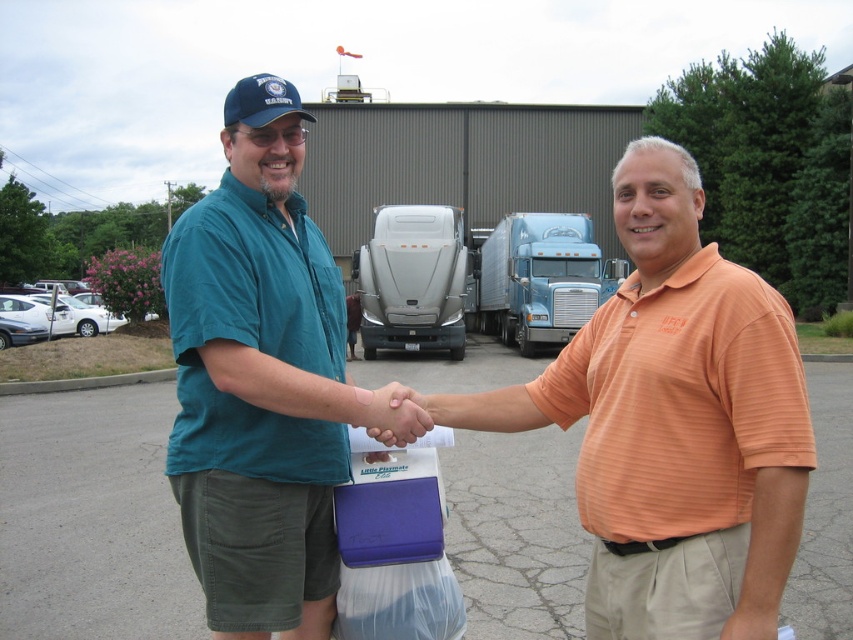
Who is positioned more to the left, blue metallic truck at center or satin silver semi-truck at center?

From the viewer's perspective, satin silver semi-truck at center appears more on the left side.

Between blue metallic truck at center and satin silver semi-truck at center, which one is positioned higher?

blue metallic truck at center is higher up.

Is point (520, 250) closer to camera compared to point (366, 310)?

No, (520, 250) is further to viewer.

Identify the location of blue metallic truck at center. The width and height of the screenshot is (853, 640). (538, 278).

Can you confirm if teal shirt at center is shorter than satin silver semi-truck at center?

Correct, teal shirt at center is not as tall as satin silver semi-truck at center.

Is teal shirt at center smaller than satin silver semi-truck at center?

No.

What do you see at coordinates (262, 381) in the screenshot?
I see `teal shirt at center` at bounding box center [262, 381].

The image size is (853, 640). Identify the location of teal shirt at center. (262, 381).

Find the location of a particular element. This screenshot has height=640, width=853. orange striped polo shirt at center is located at coordinates (672, 422).

Is orange striped polo shirt at center shorter than teal shirt at center?

Correct, orange striped polo shirt at center is not as tall as teal shirt at center.

You are a GUI agent. You are given a task and a screenshot of the screen. Output one action in this format:
    pyautogui.click(x=<x>, y=<y>)
    Task: Click on the orange striped polo shirt at center
    
    Given the screenshot: What is the action you would take?
    (x=672, y=422)